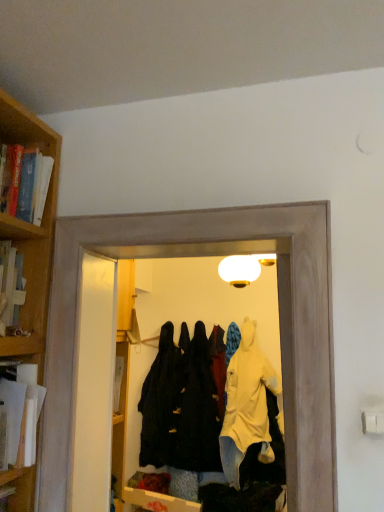
Question: From the image's perspective, is black matte coat at center, the third clothing viewed from the front, above or below dark matte coat at center, which is the 1th clothing from front to back?

Choices:
 (A) above
 (B) below

Answer: (B)

Question: Considering the positions of black matte coat at center, the third clothing viewed from the front, and dark matte coat at center, marked as the 3th clothing in a back-to-front arrangement, in the image, is black matte coat at center, the third clothing viewed from the front, wider or thinner than dark matte coat at center, marked as the 3th clothing in a back-to-front arrangement,?

Choices:
 (A) wide
 (B) thin

Answer: (A)

Question: Which of these objects is positioned closest to the yellow matte raincoat at center, the 2th clothing from the back?

Choices:
 (A) hardcover book at left, the 1th book in the top-to-bottom sequence
 (B) transparent plastic coat hanger at center
 (C) black matte coat at center, which is the 1th clothing from back to front
 (D) white paper at left, which appears as the 2th book when viewed from the top
 (E) dark matte coat at center, marked as the 3th clothing in a back-to-front arrangement

Answer: (E)

Question: Based on their relative distances, which object is farther from the yellow matte raincoat at center, which is counted as the second clothing, starting from the front?

Choices:
 (A) hardcover book at left, the 1th book in the top-to-bottom sequence
 (B) dark matte coat at center, which is the 1th clothing from front to back
 (C) black matte coat at center, the third clothing viewed from the front
 (D) transparent plastic coat hanger at center
 (E) white paper at left, acting as the first book starting from the bottom

Answer: (A)